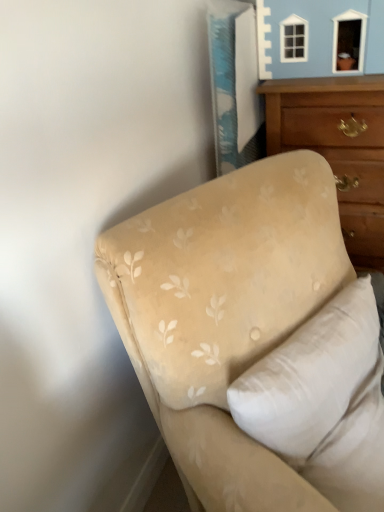
What do you see at coordinates (310, 375) in the screenshot?
I see `beige fabric pillow at upper right` at bounding box center [310, 375].

What do you see at coordinates (338, 147) in the screenshot? The image size is (384, 512). I see `wooden chest of drawers at upper right` at bounding box center [338, 147].

Where is `beige fabric couch at lower right`? This screenshot has height=512, width=384. beige fabric couch at lower right is located at coordinates (224, 313).

Is beige fabric pillow at upper right directly adjacent to wooden chest of drawers at upper right?

There is a gap between beige fabric pillow at upper right and wooden chest of drawers at upper right.

Is beige fabric pillow at upper right positioned before wooden chest of drawers at upper right?

Yes, beige fabric pillow at upper right is in front of wooden chest of drawers at upper right.

Who is smaller, beige fabric pillow at upper right or wooden chest of drawers at upper right?

beige fabric pillow at upper right.

Based on the photo, is beige fabric pillow at upper right aimed at wooden chest of drawers at upper right?

No, beige fabric pillow at upper right is not oriented towards wooden chest of drawers at upper right.

Is wooden chest of drawers at upper right behind beige fabric pillow at upper right?

Yes, it is behind beige fabric pillow at upper right.

Would you consider wooden chest of drawers at upper right to be distant from beige fabric pillow at upper right?

No.

Between wooden chest of drawers at upper right and beige fabric pillow at upper right, which one has smaller width?

beige fabric pillow at upper right.

Based on the photo, in terms of size, does wooden chest of drawers at upper right appear bigger or smaller than beige fabric pillow at upper right?

Considering their sizes, wooden chest of drawers at upper right takes up more space than beige fabric pillow at upper right.

Find the location of `pillow above the beige fabric couch at lower right (from the image's perspective)`. pillow above the beige fabric couch at lower right (from the image's perspective) is located at coordinates (310, 375).

Considering the positions of objects beige fabric couch at lower right and beige fabric pillow at upper right in the image provided, who is in front, beige fabric couch at lower right or beige fabric pillow at upper right?

Positioned in front is beige fabric couch at lower right.

Does beige fabric couch at lower right have a lesser height compared to beige fabric pillow at upper right?

Incorrect, the height of beige fabric couch at lower right does not fall short of that of beige fabric pillow at upper right.

How different are the orientations of beige fabric couch at lower right and beige fabric pillow at upper right in degrees?

The angular difference between beige fabric couch at lower right and beige fabric pillow at upper right is 1.15 degrees.

I want to click on studio couch that is under the wooden chest of drawers at upper right (from a real-world perspective), so click(224, 313).

Who is smaller, wooden chest of drawers at upper right or beige fabric couch at lower right?

wooden chest of drawers at upper right.

Which is more to the left, wooden chest of drawers at upper right or beige fabric couch at lower right?

beige fabric couch at lower right.

What's the angular difference between wooden chest of drawers at upper right and beige fabric couch at lower right's facing directions?

They differ by 61 degrees in their facing directions.

From a real-world perspective, which is physically below, beige fabric couch at lower right or wooden chest of drawers at upper right?

beige fabric couch at lower right is physically lower.

Is beige fabric couch at lower right not inside wooden chest of drawers at upper right?

Absolutely, beige fabric couch at lower right is external to wooden chest of drawers at upper right.

From the picture: Considering the positions of objects beige fabric couch at lower right and wooden chest of drawers at upper right in the image provided, who is more to the left, beige fabric couch at lower right or wooden chest of drawers at upper right?

From the viewer's perspective, beige fabric couch at lower right appears more on the left side.

Is beige fabric pillow at upper right beside beige fabric couch at lower right?

beige fabric pillow at upper right is not next to beige fabric couch at lower right, and they're not touching.

Between beige fabric pillow at upper right and beige fabric couch at lower right, which one has less height?

beige fabric pillow at upper right is shorter.

What's the angular difference between beige fabric pillow at upper right and beige fabric couch at lower right's facing directions?

The angle between the facing direction of beige fabric pillow at upper right and the facing direction of beige fabric couch at lower right is 1.15 degrees.

In the image, is beige fabric pillow at upper right on the left side or the right side of beige fabric couch at lower right?

Clearly, beige fabric pillow at upper right is on the right of beige fabric couch at lower right in the image.

Find the location of a particular element. chest of drawers behind the beige fabric pillow at upper right is located at coordinates (338, 147).

Find the location of a particular element. the chest of drawers that appears below the beige fabric pillow at upper right (from a real-world perspective) is located at coordinates (x=338, y=147).

Estimate the real-world distances between objects in this image. Which object is closer to beige fabric couch at lower right, beige fabric pillow at upper right or wooden chest of drawers at upper right?

beige fabric pillow at upper right.

Considering their positions, is wooden chest of drawers at upper right positioned further to beige fabric pillow at upper right than beige fabric couch at lower right?

wooden chest of drawers at upper right lies further to beige fabric pillow at upper right than the other object.

Estimate the real-world distances between objects in this image. Which object is closer to beige fabric couch at lower right, wooden chest of drawers at upper right or beige fabric pillow at upper right?

beige fabric pillow at upper right lies closer to beige fabric couch at lower right than the other object.

When comparing their distances from wooden chest of drawers at upper right, does beige fabric pillow at upper right or beige fabric couch at lower right seem closer?

Based on the image, beige fabric couch at lower right appears to be nearer to wooden chest of drawers at upper right.

Estimate the real-world distances between objects in this image. Which object is closer to beige fabric pillow at upper right, beige fabric couch at lower right or wooden chest of drawers at upper right?

beige fabric couch at lower right is closer to beige fabric pillow at upper right.

When comparing their distances from wooden chest of drawers at upper right, does beige fabric couch at lower right or beige fabric pillow at upper right seem further?

beige fabric pillow at upper right is positioned further to the anchor wooden chest of drawers at upper right.

You are a GUI agent. You are given a task and a screenshot of the screen. Output one action in this format:
    pyautogui.click(x=<x>, y=<y>)
    Task: Click on the pillow between beige fabric couch at lower right and wooden chest of drawers at upper right from front to back
    Image resolution: width=384 pixels, height=512 pixels.
    Given the screenshot: What is the action you would take?
    pyautogui.click(x=310, y=375)